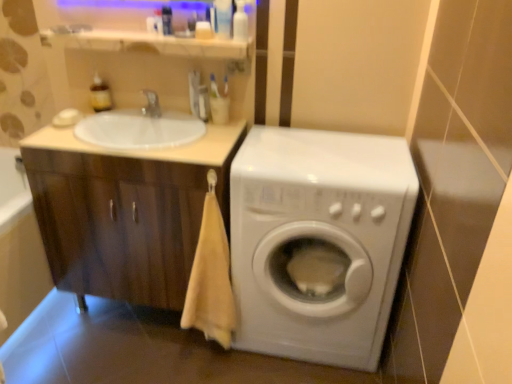
Locate an element on the screen. vacant space to the right of white matte soap at upper left, which is the 2th soap from top to bottom is located at coordinates (116, 118).